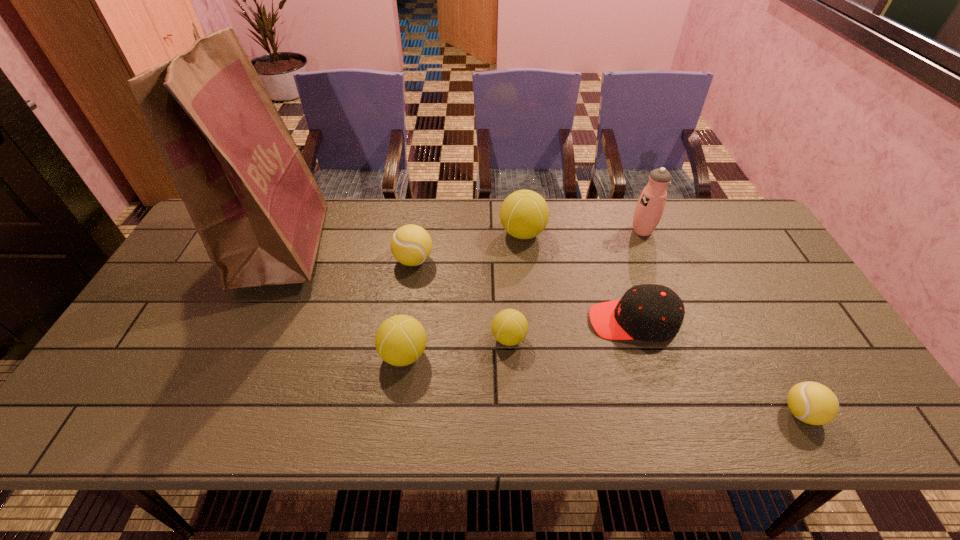
In order to click on vacant space located on the left of the right yellow tennis ball in this screenshot , I will do `click(655, 413)`.

The height and width of the screenshot is (540, 960). In order to click on free region located on the right of the smallest green tennis ball in this screenshot , I will do `click(621, 338)`.

Find the location of a particular element. grocery bag that is at the far edge is located at coordinates (256, 206).

What are the coordinates of `thermos bottle located at the far edge` in the screenshot? It's located at click(x=649, y=209).

Locate an element on the screen. tennis ball located at the far edge is located at coordinates (524, 214).

You are a GUI agent. You are given a task and a screenshot of the screen. Output one action in this format:
    pyautogui.click(x=<x>, y=<y>)
    Task: Click on the object that is at the near edge
    The height and width of the screenshot is (540, 960).
    Given the screenshot: What is the action you would take?
    pyautogui.click(x=813, y=403)

Locate an element on the screen. The height and width of the screenshot is (540, 960). object located in the left edge section of the desktop is located at coordinates (256, 206).

This screenshot has height=540, width=960. I want to click on object that is at the right edge, so click(813, 403).

The image size is (960, 540). In order to click on object positioned at the far left corner in this screenshot , I will do `click(256, 206)`.

Find the location of `object at the near right corner`. object at the near right corner is located at coordinates (813, 403).